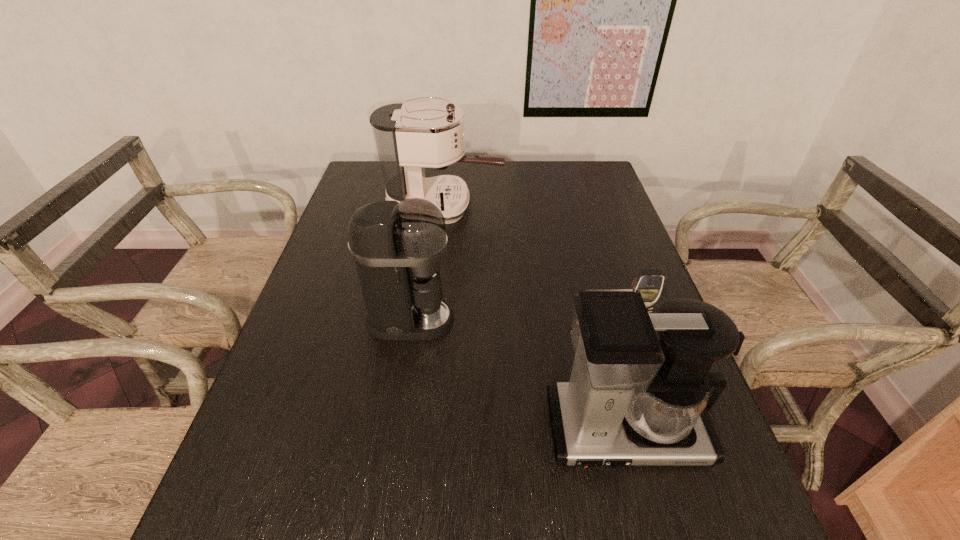
Find the location of a particular element. The image size is (960, 540). free space that is in between the second farthest coffee maker and the shortest object is located at coordinates (523, 319).

Identify the location of vacant region between the farthest coffee maker and the nearest object. The width and height of the screenshot is (960, 540). (535, 318).

The height and width of the screenshot is (540, 960). What are the coordinates of `free point between the rightmost coffee maker and the second farthest coffee maker` in the screenshot? It's located at (517, 375).

I want to click on object that is the second closest one to the shortest object, so click(398, 247).

Locate an element on the screen. the second closest object to the nearest object is located at coordinates (398, 247).

This screenshot has height=540, width=960. Identify the location of coffee maker that is the nearest to the farthest coffee maker. (398, 247).

Identify the location of the second closest coffee maker to the cellular telephone. (398, 247).

The width and height of the screenshot is (960, 540). What are the coordinates of `free spot that satisfies the following two spatial constraints: 1. on the front face of the cellular telephone; 2. place cup under the spout of the second nearest coffee maker` in the screenshot? It's located at (636, 320).

Locate an element on the screen. This screenshot has height=540, width=960. free space that satisfies the following two spatial constraints: 1. on the front face of the shortest object; 2. place cup under the spout of the second nearest coffee maker is located at coordinates (636, 320).

Where is `vacant region that satisfies the following two spatial constraints: 1. on the front face of the cellular telephone; 2. place cup under the spout of the second nearest coffee maker`? vacant region that satisfies the following two spatial constraints: 1. on the front face of the cellular telephone; 2. place cup under the spout of the second nearest coffee maker is located at coordinates (636, 320).